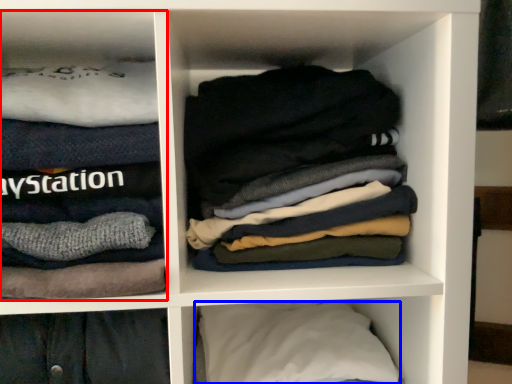
Question: Among these objects, which one is nearest to the camera, cabinet (highlighted by a red box) or pillow (highlighted by a blue box)?

Choices:
 (A) cabinet
 (B) pillow

Answer: (A)